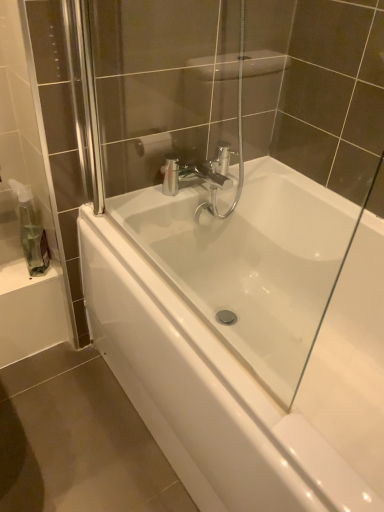
Question: Is transparent plastic soap dispenser at left situated inside white glossy bathtub at center or outside?

Choices:
 (A) inside
 (B) outside

Answer: (B)

Question: Relative to white glossy bathtub at center, is transparent plastic soap dispenser at left in front or behind?

Choices:
 (A) front
 (B) behind

Answer: (B)

Question: Is transparent plastic soap dispenser at left taller or shorter than white glossy bathtub at center?

Choices:
 (A) short
 (B) tall

Answer: (A)

Question: Is point [198, 275] positioned closer to the camera than point [48, 252]?

Choices:
 (A) closer
 (B) farther

Answer: (B)

Question: From the image's perspective, is white glossy bathtub at center located above or below transparent plastic soap dispenser at left?

Choices:
 (A) below
 (B) above

Answer: (A)

Question: In the image, is white glossy bathtub at center positioned in front of or behind transparent plastic soap dispenser at left?

Choices:
 (A) behind
 (B) front

Answer: (B)

Question: Is white glossy bathtub at center inside the boundaries of transparent plastic soap dispenser at left, or outside?

Choices:
 (A) inside
 (B) outside

Answer: (B)